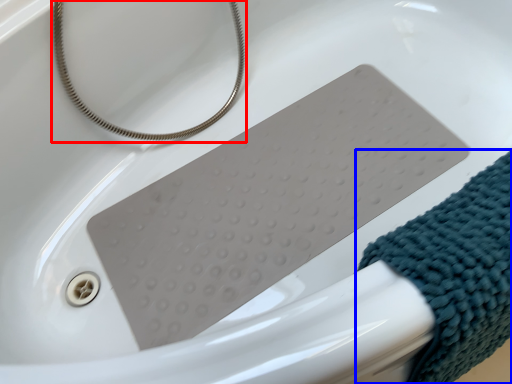
Question: Which object appears farthest to the camera in this image, string (highlighted by a red box) or wrap (highlighted by a blue box)?

Choices:
 (A) string
 (B) wrap

Answer: (A)